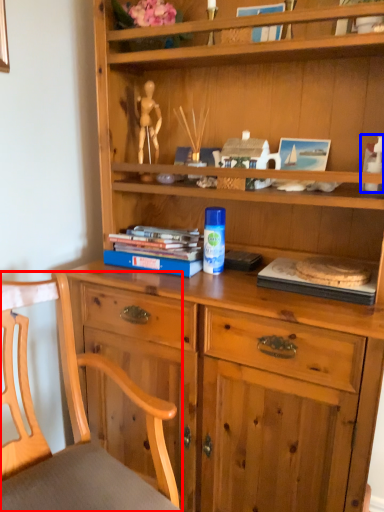
Question: Which object appears closest to the camera in this image, chair (highlighted by a red box) or toy (highlighted by a blue box)?

Choices:
 (A) chair
 (B) toy

Answer: (A)